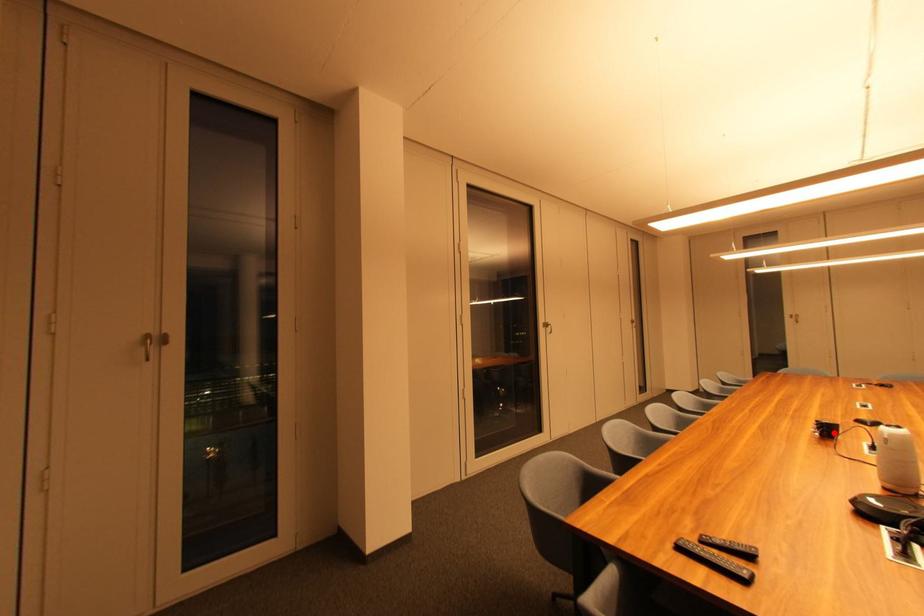
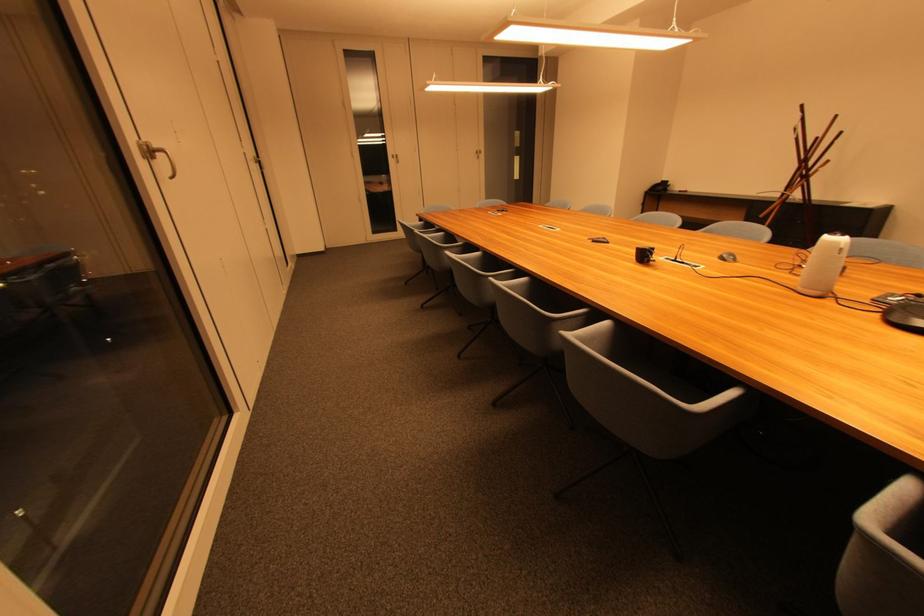
Locate, in the second image, the point that corresponds to the highlighted location in the first image.

(649, 257)